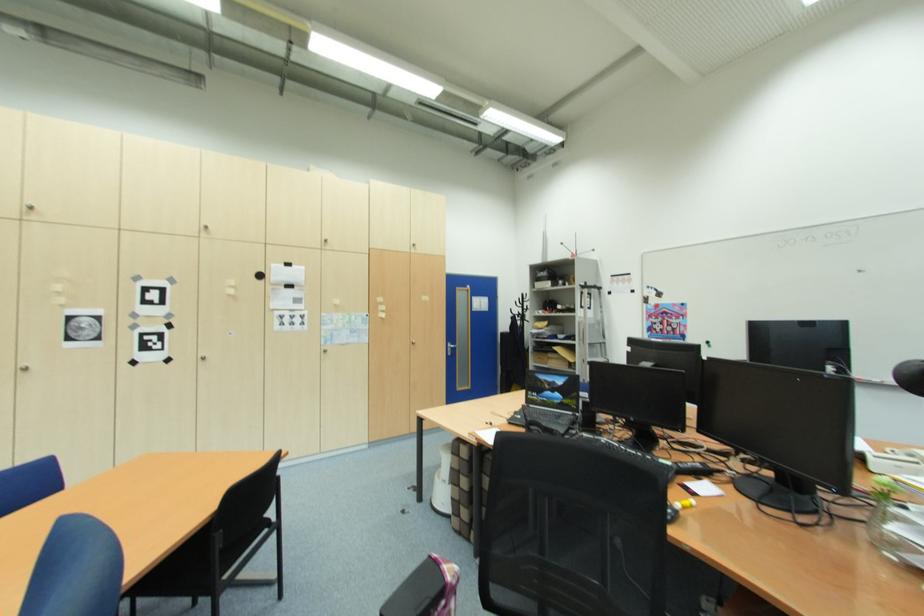
Find where to lift the laptop computer. Please return your answer as a coordinate pair (x, y).

(549, 402)